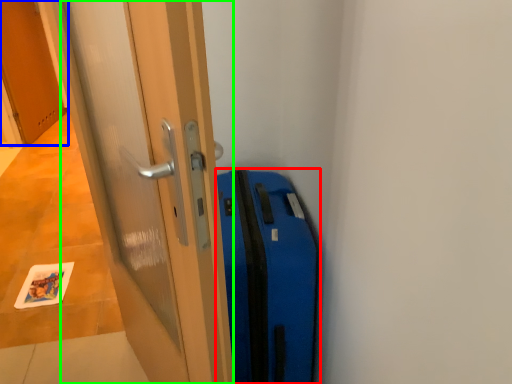
Question: Based on their relative distances, which object is nearer to suitcase (highlighted by a red box)? Choose from door (highlighted by a blue box) and door (highlighted by a green box).

Choices:
 (A) door
 (B) door

Answer: (B)